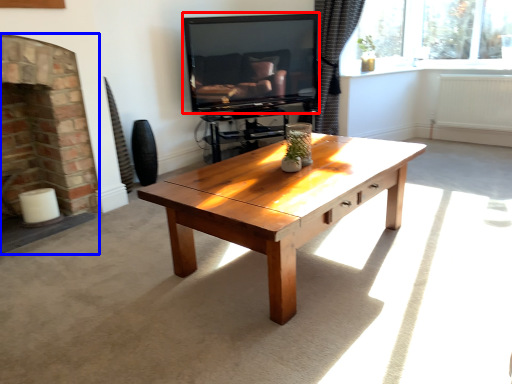
Question: Which object is further to the camera taking this photo, television (highlighted by a red box) or fireplace (highlighted by a blue box)?

Choices:
 (A) television
 (B) fireplace

Answer: (A)